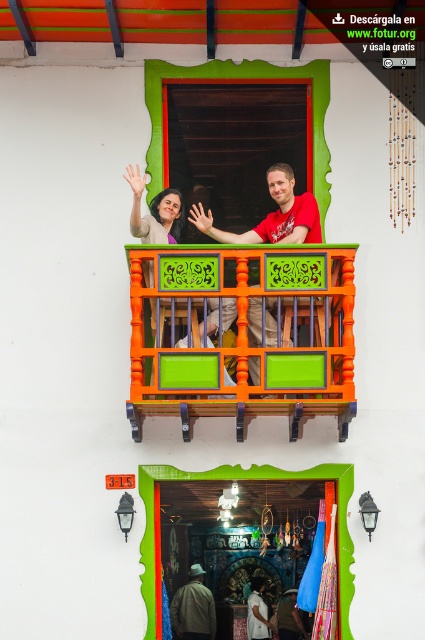
Who is lower down, green painted wooden door at center or matte purple blouse at upper center?

Positioned lower is green painted wooden door at center.

Locate an element on the screen. The image size is (425, 640). green painted wooden door at center is located at coordinates (241, 480).

Is point (268, 474) more distant than point (133, 220)?

That is True.

Image resolution: width=425 pixels, height=640 pixels. What are the coordinates of `green painted wooden door at center` in the screenshot? It's located at (241, 480).

Is point (149, 499) more distant than point (272, 221)?

No, (149, 499) is closer to viewer.

Does green painted wooden door at center come behind red matte shirt at center?

No.

The height and width of the screenshot is (640, 425). What are the coordinates of `green painted wooden door at center` in the screenshot? It's located at (241, 480).

Does point (295, 376) come farther from viewer compared to point (155, 515)?

No.

Does point (325, 362) come closer to viewer compared to point (300, 472)?

Yes.

Locate an element on the screen. Image resolution: width=425 pixels, height=640 pixels. orange painted wood balcony at center is located at coordinates pyautogui.click(x=243, y=337).